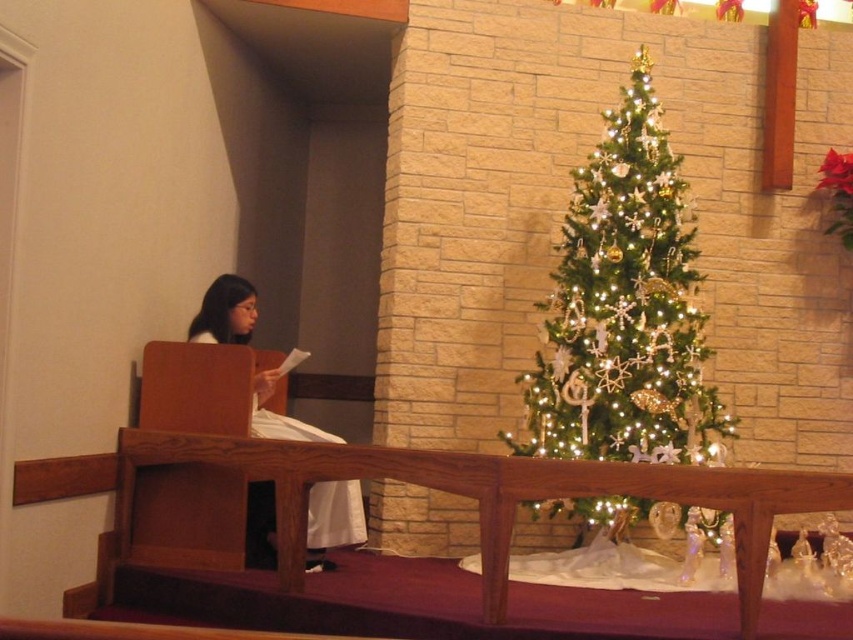
Based on the photo, which is more to the left, iridescent gold christmas tree at center or white fabric at left?

white fabric at left

Can you confirm if iridescent gold christmas tree at center is positioned above white fabric at left?

Indeed, iridescent gold christmas tree at center is positioned over white fabric at left.

Locate an element on the screen. This screenshot has width=853, height=640. iridescent gold christmas tree at center is located at coordinates (625, 308).